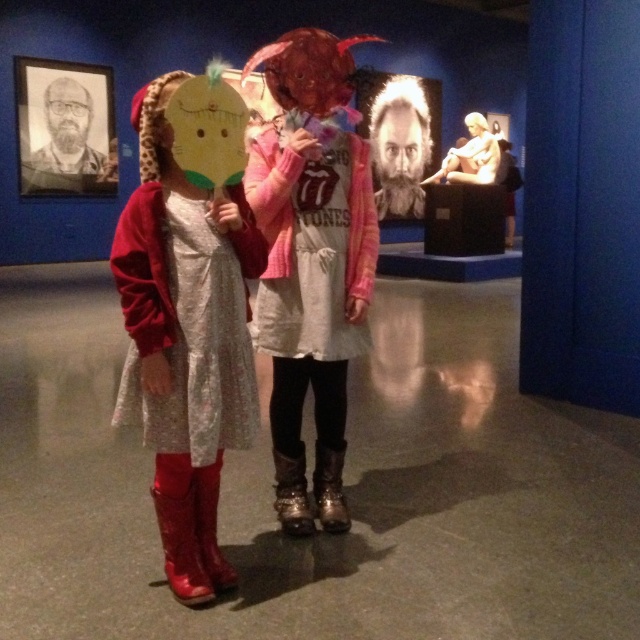
What is the position of the point labeled as point (400,147) in the image?

The point labeled as point (400,147) is located on the bearded hair at center.

You are a security guard in the museum. You need to ensure that the bearded hair at center and the shiny metallic boot at lower left are not blocking the emergency exit sign. Which object is wider and might be more likely to obstruct the sign?

The bearded hair at center is wider than the shiny metallic boot at lower left, so it is more likely to obstruct the emergency exit sign.

You are a photographer setting up a shoot in the museum. You want to ensure both the shiny red boots at left and the shiny metallic boot at lower left are in focus. Which boot should you focus on first to ensure depth of field captures both?

You should focus on the shiny metallic boot at lower left first because it is closer to the camera than the shiny red boots at left, which is farther away. By focusing on the closer object, the depth of field will extend to include the farther one.